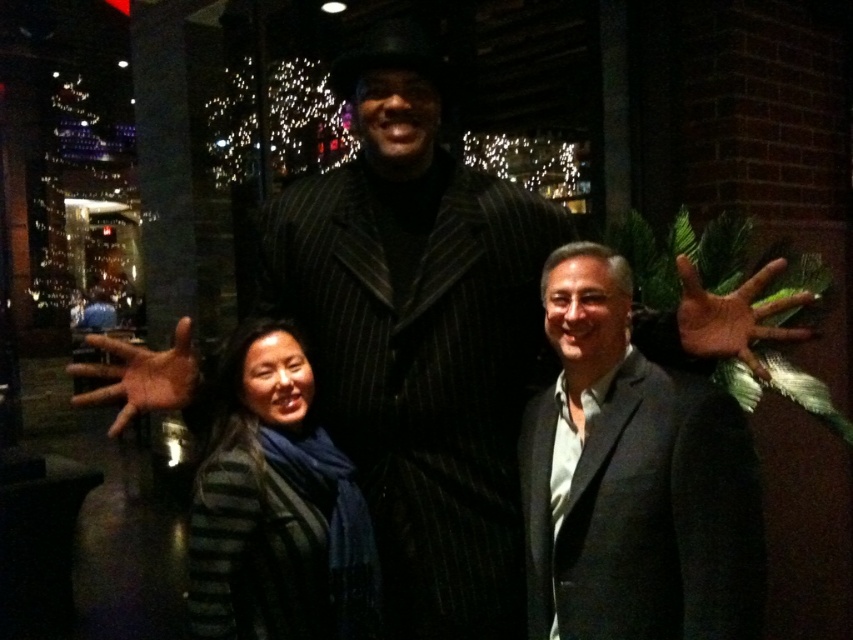
You are a photographer trying to capture a closeup of the striped sweater at center and the brown leather hand at center in the image. Which object should you zoom in on first to ensure both fit in the frame without cropping?

The striped sweater at center is wider than the brown leather hand at center, so you should zoom in on the striped sweater at center first to accommodate its larger width.

You are a photographer trying to capture a group photo of the three people in the scene. You need to ensure that the brown leather hand at center and the brown leather hand at lower left are within a 1.2 meter distance to frame them properly. Based on the scene description, do you think the current positioning allows for this?

The distance between the brown leather hand at center and the brown leather hand at lower left is 1.15 meters, which is within the 1.2 meter requirement. Therefore, the current positioning allows proper framing for the group photo.